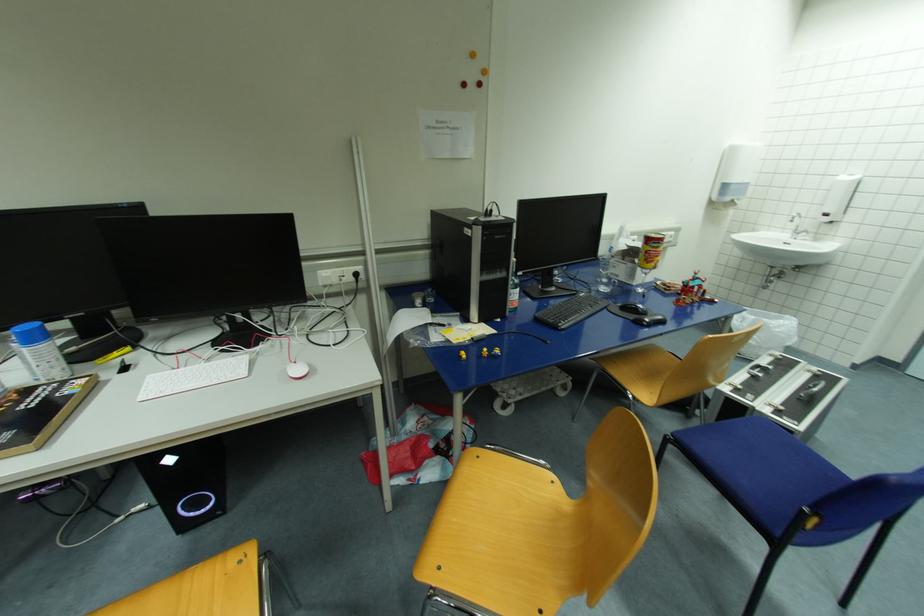
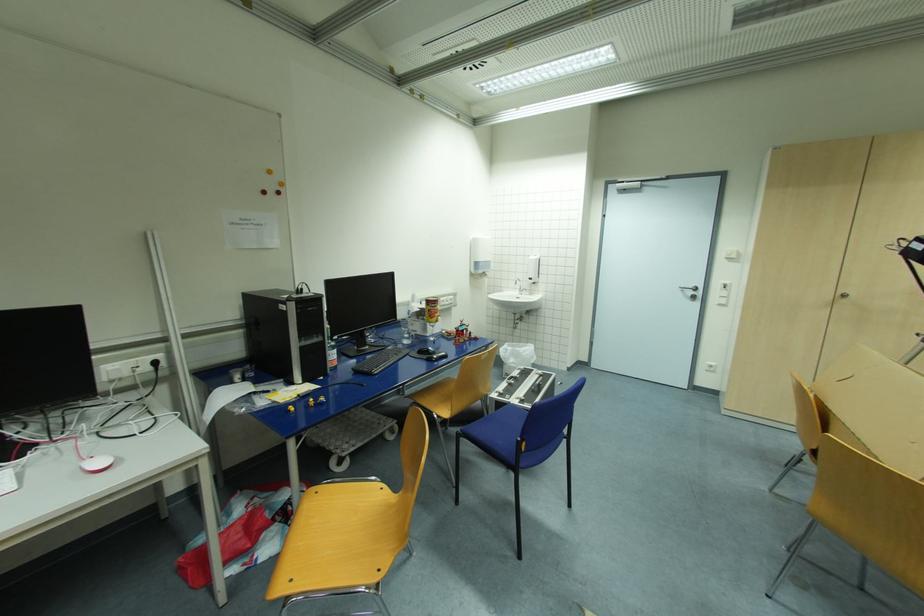
Find the pixel in the second image that matches (x=301, y=371) in the first image.

(102, 464)